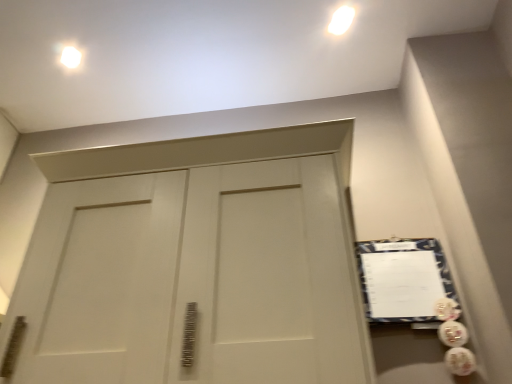
In order to click on white glossy light fixture at upper left in this screenshot , I will do `click(70, 57)`.

Measure the distance between point (69, 53) and camera.

The depth of point (69, 53) is 6.00 feet.

What is the approximate height of white glossy light fixture at upper left?

white glossy light fixture at upper left is 1.98 centimeters tall.

The image size is (512, 384). What do you see at coordinates (70, 57) in the screenshot?
I see `white glossy light fixture at upper left` at bounding box center [70, 57].

Measure the distance between white fabric bulletin board at right and camera.

The depth of white fabric bulletin board at right is 4.37 feet.

Where is `white fabric bulletin board at right`? Image resolution: width=512 pixels, height=384 pixels. white fabric bulletin board at right is located at coordinates (403, 279).

Describe the element at coordinates (403, 279) in the screenshot. The width and height of the screenshot is (512, 384). I see `white fabric bulletin board at right` at that location.

Where is `white glossy light fixture at upper left`? This screenshot has height=384, width=512. white glossy light fixture at upper left is located at coordinates (70, 57).

Does white glossy light fixture at upper left appear on the left side of white fabric bulletin board at right?

Yes, white glossy light fixture at upper left is to the left of white fabric bulletin board at right.

Is white glossy light fixture at upper left positioned before white fabric bulletin board at right?

No.

Is point (73, 52) behind point (423, 318)?

Yes, point (73, 52) is behind point (423, 318).

From the image's perspective, between white glossy light fixture at upper left and white fabric bulletin board at right, who is located below?

From the image's view, white fabric bulletin board at right is below.

From a real-world perspective, relative to white fabric bulletin board at right, is white glossy light fixture at upper left vertically above or below?

white glossy light fixture at upper left is above white fabric bulletin board at right.

Can you confirm if white glossy light fixture at upper left is wider than white fabric bulletin board at right?

Indeed, white glossy light fixture at upper left has a greater width compared to white fabric bulletin board at right.

Does white glossy light fixture at upper left have a lesser height compared to white fabric bulletin board at right?

Correct, white glossy light fixture at upper left is not as tall as white fabric bulletin board at right.

Which of these two, white glossy light fixture at upper left or white fabric bulletin board at right, is bigger?

Bigger between the two is white fabric bulletin board at right.

Is white glossy light fixture at upper left not inside white fabric bulletin board at right?

white glossy light fixture at upper left lies outside white fabric bulletin board at right's area.

Is white glossy light fixture at upper left in contact with white fabric bulletin board at right?

white glossy light fixture at upper left and white fabric bulletin board at right are clearly separated.

In the scene shown: Is white glossy light fixture at upper left turned away from white fabric bulletin board at right?

No, white glossy light fixture at upper left is not facing the opposite direction of white fabric bulletin board at right.

How far apart are white glossy light fixture at upper left and white fabric bulletin board at right?

They are 5.19 feet apart.

I want to click on lighting behind the white fabric bulletin board at right, so click(x=70, y=57).

Which object is positioned more to the left, white fabric bulletin board at right or white glossy light fixture at upper left?

From the viewer's perspective, white glossy light fixture at upper left appears more on the left side.

Is white fabric bulletin board at right closer to the viewer compared to white glossy light fixture at upper left?

Yes, white fabric bulletin board at right is in front of white glossy light fixture at upper left.

Is point (418, 318) positioned before point (68, 52)?

Yes, point (418, 318) is in front of point (68, 52).

From the image's perspective, between white fabric bulletin board at right and white glossy light fixture at upper left, who is located below?

white fabric bulletin board at right is shown below in the image.

From a real-world perspective, who is located lower, white fabric bulletin board at right or white glossy light fixture at upper left?

white fabric bulletin board at right.

Can you confirm if white fabric bulletin board at right is thinner than white glossy light fixture at upper left?

Yes.

Who is taller, white fabric bulletin board at right or white glossy light fixture at upper left?

With more height is white fabric bulletin board at right.

Does white fabric bulletin board at right have a larger size compared to white glossy light fixture at upper left?

Correct, white fabric bulletin board at right is larger in size than white glossy light fixture at upper left.

Could white glossy light fixture at upper left be considered to be inside white fabric bulletin board at right?

No, white fabric bulletin board at right does not contain white glossy light fixture at upper left.

Is white fabric bulletin board at right beside white glossy light fixture at upper left?

white fabric bulletin board at right and white glossy light fixture at upper left are not in contact.

Is white fabric bulletin board at right facing towards white glossy light fixture at upper left?

No, white fabric bulletin board at right is not aimed at white glossy light fixture at upper left.

This screenshot has height=384, width=512. Find the location of `lighting positioned vertically above the white fabric bulletin board at right (from a real-world perspective)`. lighting positioned vertically above the white fabric bulletin board at right (from a real-world perspective) is located at coordinates pyautogui.click(x=70, y=57).

At what (x,y) coordinates should I click in order to perform the action: click on bulletin board below the white glossy light fixture at upper left (from the image's perspective). Please return your answer as a coordinate pair (x, y). This screenshot has width=512, height=384. Looking at the image, I should click on (403, 279).

Identify the location of bulletin board in front of the white glossy light fixture at upper left. The width and height of the screenshot is (512, 384). (403, 279).